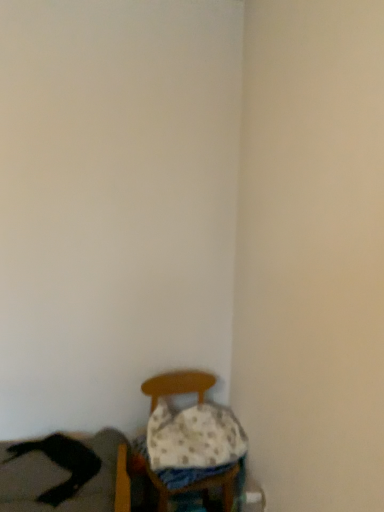
Question: Is white dotted fabric pillow at lower center positioned far away from black leather couch at lower left?

Choices:
 (A) yes
 (B) no

Answer: (B)

Question: Is white dotted fabric pillow at lower center facing away from black leather couch at lower left?

Choices:
 (A) yes
 (B) no

Answer: (B)

Question: From the image's perspective, would you say white dotted fabric pillow at lower center is positioned over black leather couch at lower left?

Choices:
 (A) yes
 (B) no

Answer: (A)

Question: From a real-world perspective, is white dotted fabric pillow at lower center located beneath black leather couch at lower left?

Choices:
 (A) no
 (B) yes

Answer: (A)

Question: Does white dotted fabric pillow at lower center contain black leather couch at lower left?

Choices:
 (A) yes
 (B) no

Answer: (B)

Question: Does white dotted fabric pillow at lower center lie in front of black leather couch at lower left?

Choices:
 (A) yes
 (B) no

Answer: (B)

Question: Is the surface of white dotted fabric pillow at lower center in direct contact with wooden chair at lower center?

Choices:
 (A) no
 (B) yes

Answer: (A)

Question: Does white dotted fabric pillow at lower center come behind wooden chair at lower center?

Choices:
 (A) yes
 (B) no

Answer: (A)

Question: Would you say wooden chair at lower center is part of white dotted fabric pillow at lower center's contents?

Choices:
 (A) no
 (B) yes

Answer: (A)

Question: Are white dotted fabric pillow at lower center and wooden chair at lower center far apart?

Choices:
 (A) no
 (B) yes

Answer: (A)

Question: From the image's perspective, does white dotted fabric pillow at lower center appear lower than wooden chair at lower center?

Choices:
 (A) yes
 (B) no

Answer: (B)

Question: Is white dotted fabric pillow at lower center in front of wooden chair at lower center?

Choices:
 (A) no
 (B) yes

Answer: (A)

Question: From the image's perspective, is black leather couch at lower left above white dotted fabric pillow at lower center?

Choices:
 (A) no
 (B) yes

Answer: (A)